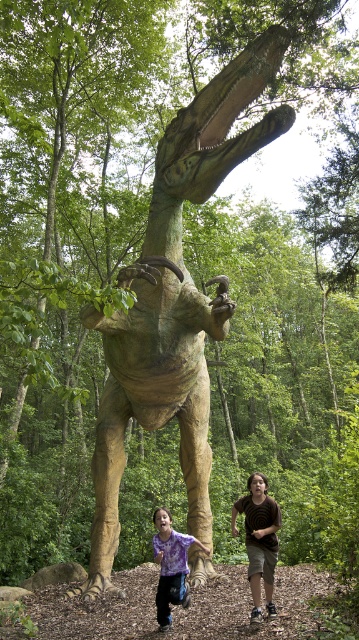
Question: Which object is positioned farthest from the green textured dinosaur at center?

Choices:
 (A) brown cotton shirt at lower center
 (B) purple tie-dye shirt at lower center

Answer: (A)

Question: Does green textured dinosaur at center have a lesser width compared to brown cotton shirt at lower center?

Choices:
 (A) yes
 (B) no

Answer: (B)

Question: Where is green textured dinosaur at center located in relation to purple tie-dye shirt at lower center in the image?

Choices:
 (A) right
 (B) left

Answer: (B)

Question: Which point is farther to the camera?

Choices:
 (A) (260, 480)
 (B) (238, 99)

Answer: (B)

Question: Is brown cotton shirt at lower center below purple tie-dye shirt at lower center?

Choices:
 (A) no
 (B) yes

Answer: (A)

Question: Which point appears closest to the camera in this image?

Choices:
 (A) (232, 525)
 (B) (212, 156)
 (C) (184, 563)

Answer: (A)